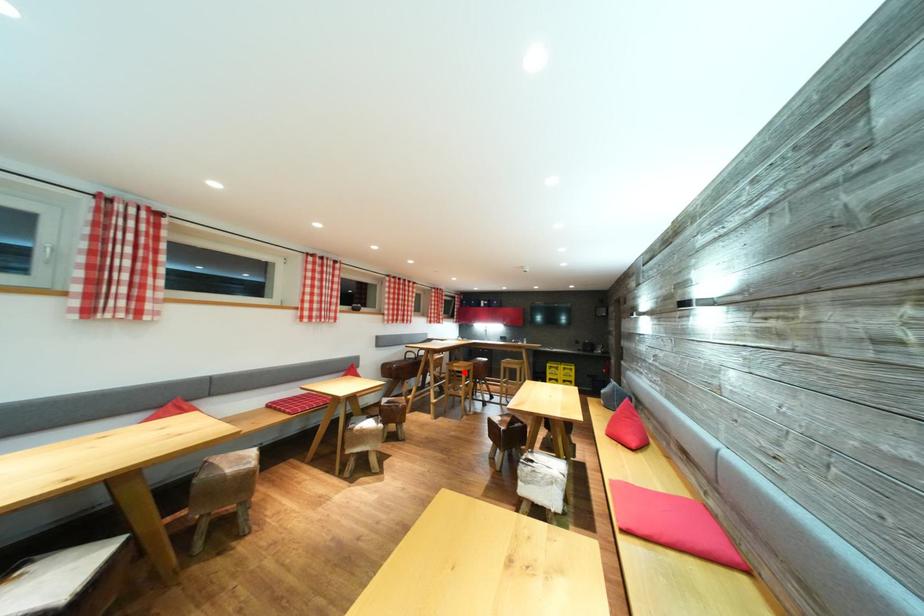
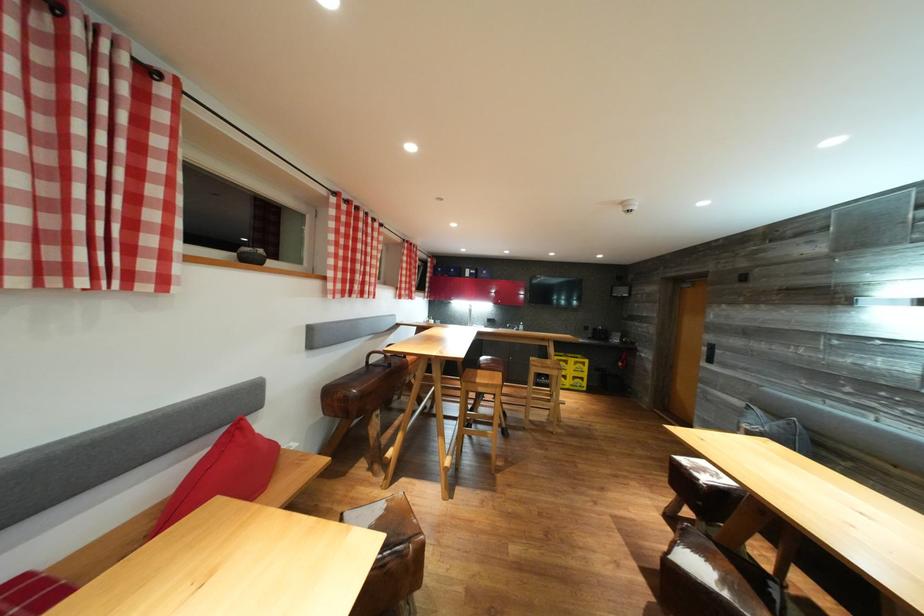
Where in the second image is the point corresponding to the highlighted location from the first image?

(492, 391)